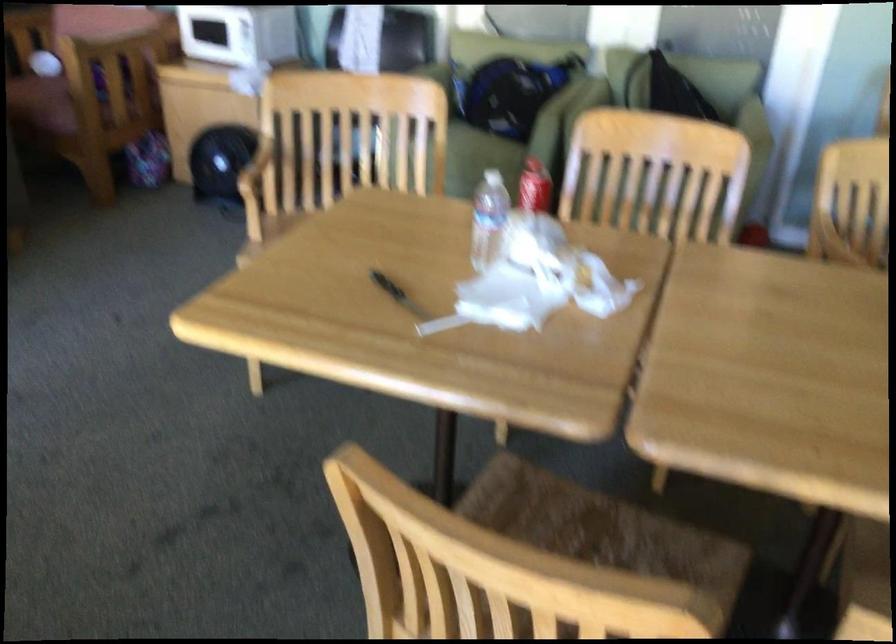
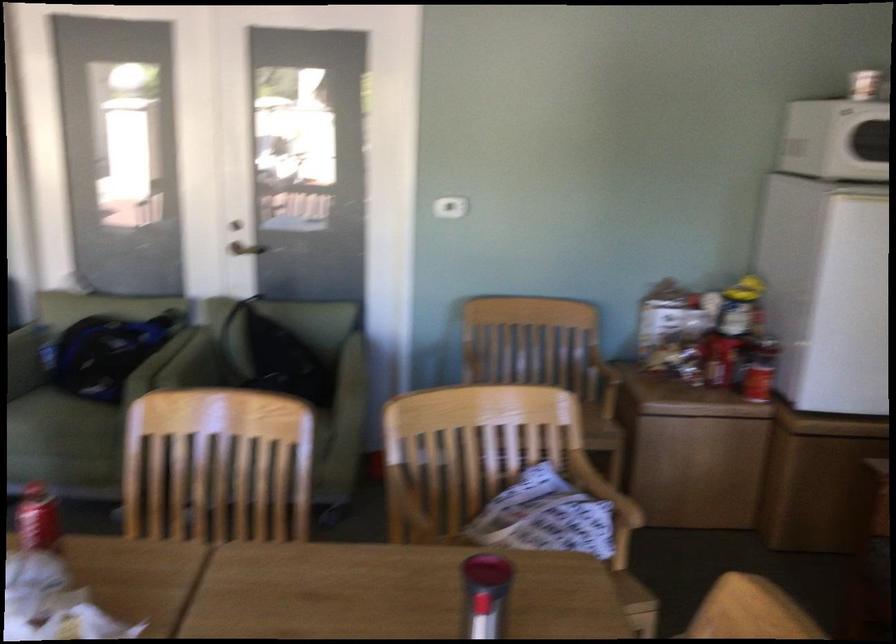
Where in the second image is the point corresponding to the point at 645,185 from the first image?

(217, 466)